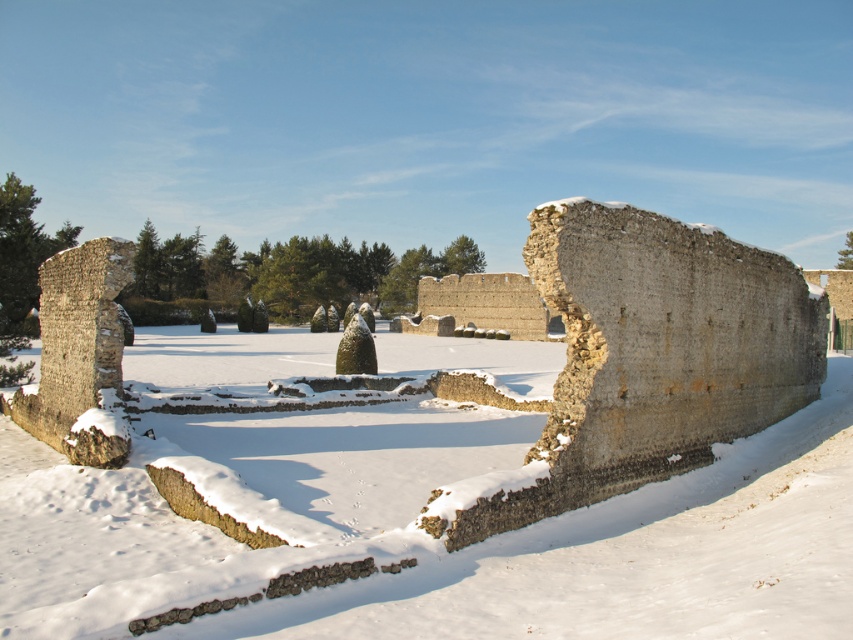
The width and height of the screenshot is (853, 640). What do you see at coordinates (430, 540) in the screenshot?
I see `white powdery snow at center` at bounding box center [430, 540].

From the picture: Is white powdery snow at center to the left of rustic stone wall at center from the viewer's perspective?

Yes, white powdery snow at center is to the left of rustic stone wall at center.

Between point (131, 600) and point (767, 296), which one is positioned behind?

The point (767, 296) is behind.

This screenshot has width=853, height=640. What are the coordinates of `white powdery snow at center` in the screenshot? It's located at (430, 540).